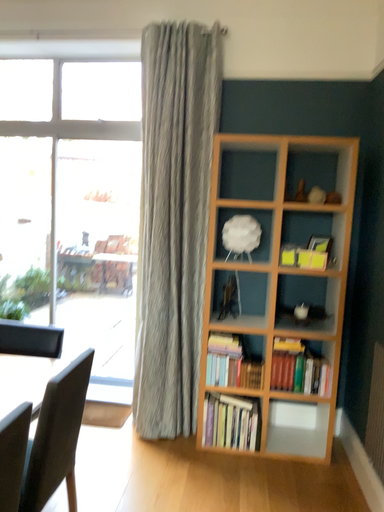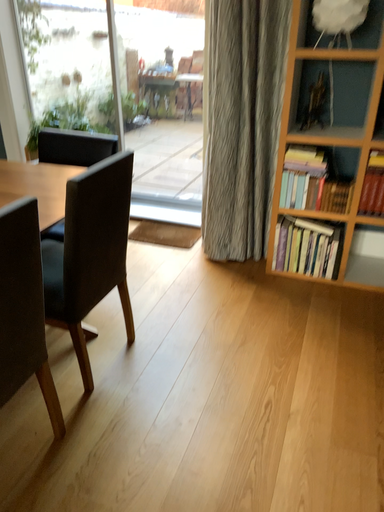
Question: How did the camera likely rotate when shooting the video?

Choices:
 (A) rotated downward
 (B) rotated upward

Answer: (A)